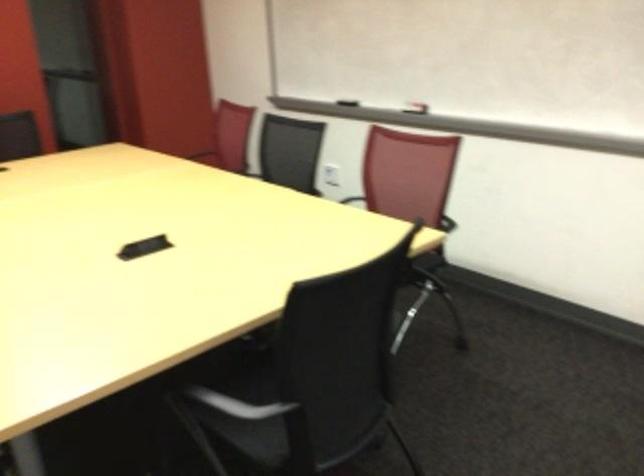
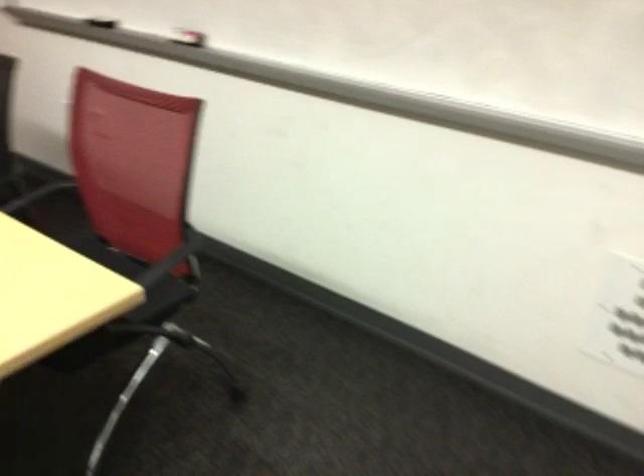
Locate, in the second image, the point that corresponds to (424,107) in the first image.

(196, 43)